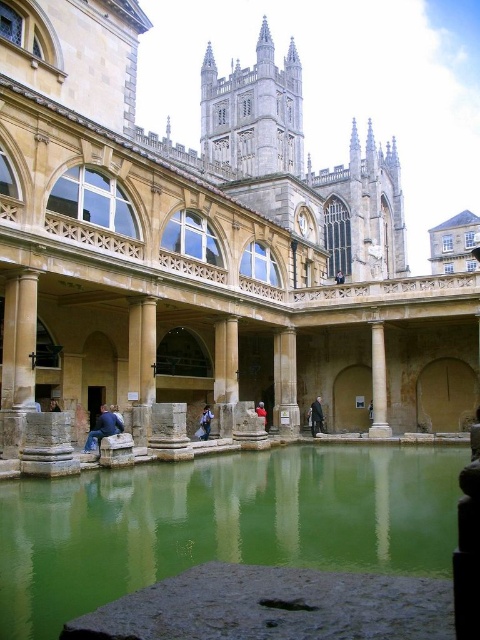
You are a tourist visiting the Roman Baths in Bath, England. You notice the stone water at center and the white marble column at center. Which one is wider?

The stone water at center is wider than the white marble column at center.

You are a tourist standing at the entrance of the Roman Baths in Bath, England. You want to take a photo of the white marble column at center. Considering your camera has a maximum focus range of 60 meters, will you be able to capture the column clearly in your photo?

The white marble column at center is 65.63 meters away from the camera. Since the camera can only focus up to 60 meters, it won cannot capture the column clearly. You may need to move closer or use a different camera with a longer range.

You are visiting the Roman Baths in Bath, England. You notice a white marble column at center and a dark gray suit at center. Which object is positioned higher in the scene?

The white marble column at center is located above the dark gray suit at center, so it is positioned higher in the scene.